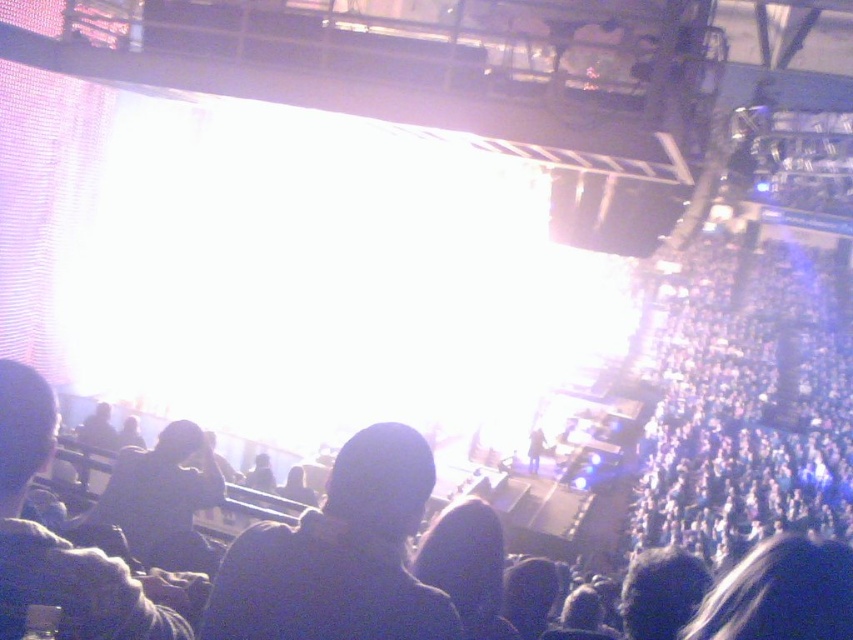
Question: Which of the following is the closest to the observer?

Choices:
 (A) (376, 564)
 (B) (22, 372)
 (C) (749, 492)

Answer: (A)

Question: Is black matte crowd at center smaller than dark fabric hat at center?

Choices:
 (A) yes
 (B) no

Answer: (B)

Question: Can you confirm if dark fabric hat at center is positioned to the left of dark fabric hat at left?

Choices:
 (A) yes
 (B) no

Answer: (B)

Question: Does black matte crowd at center appear over dark fabric hat at left?

Choices:
 (A) yes
 (B) no

Answer: (B)

Question: Which of the following is the closest to the observer?

Choices:
 (A) (6, 468)
 (B) (711, 380)

Answer: (A)

Question: Estimate the real-world distances between objects in this image. Which object is farther from the dark fabric hat at center?

Choices:
 (A) black matte crowd at center
 (B) dark fabric hat at left

Answer: (A)